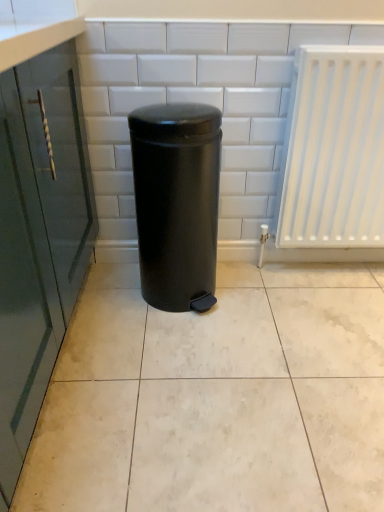
What are the coordinates of `space that is in front of black matte waste container at center` in the screenshot? It's located at pyautogui.click(x=181, y=348).